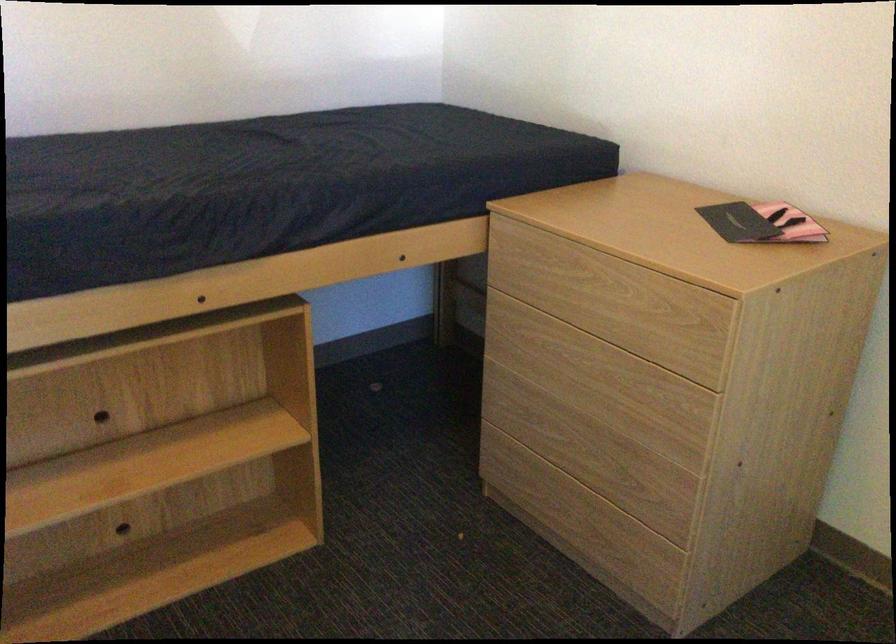
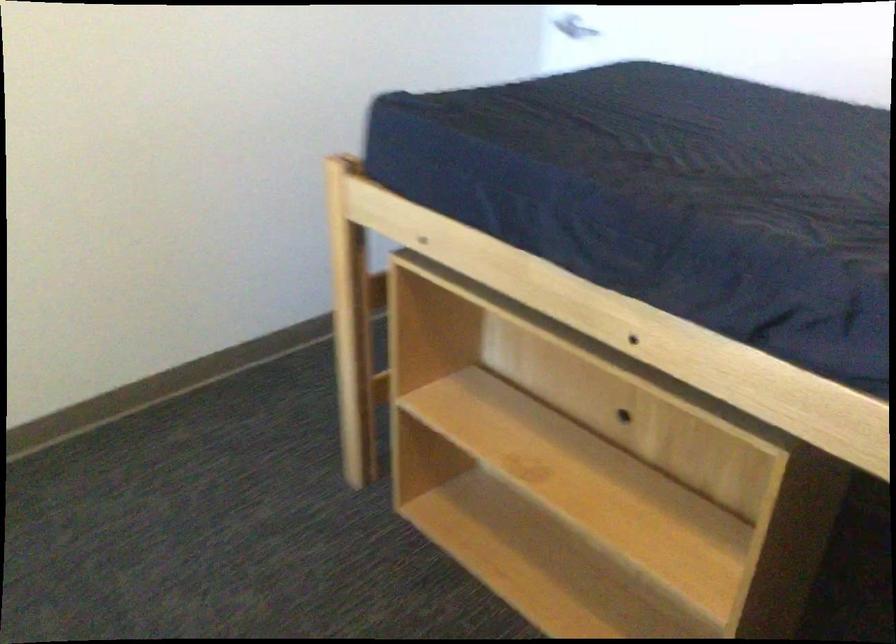
Find the pixel in the second image that matches [148,201] in the first image.

(651, 193)